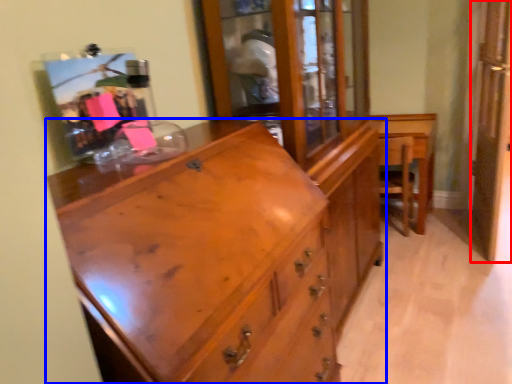
Question: Which point is further to the camera, screen door (highlighted by a red box) or chest of drawers (highlighted by a blue box)?

Choices:
 (A) screen door
 (B) chest of drawers

Answer: (A)